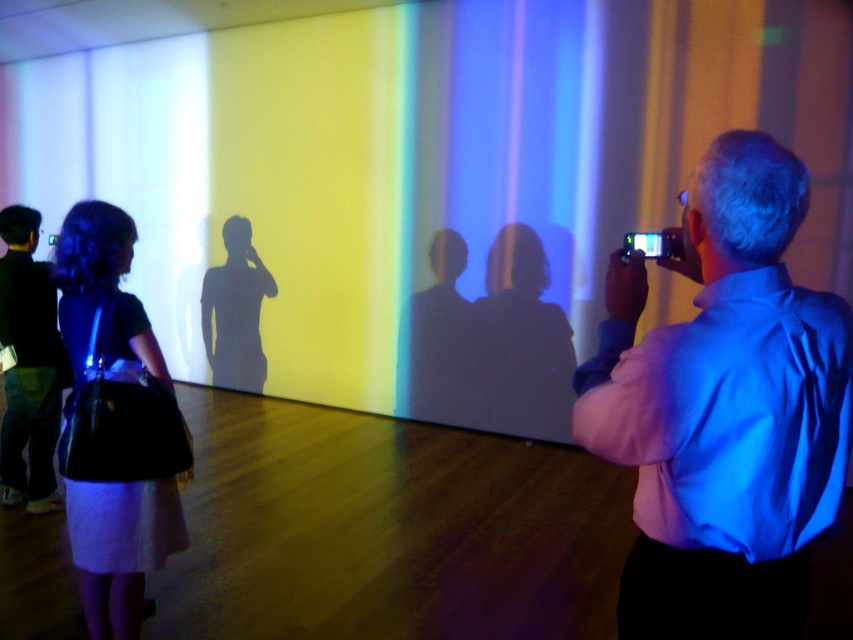
You are standing in the room where the art installation is displayed. You see a blue satin shirt at right and a matte black dress at left. Which clothing item is closer to you?

The blue satin shirt at right is closer to you because it is in front of the matte black dress at left.

You are standing in front of the art installation and want to place a small decorative item on the wall. You have two options for placement coordinates on the wall, point A at point (71, 269) and point B at point (49, 496). Which point is closer to you so that the item is more visible?

Point A at point (71, 269) is closer to the viewer than point B at point (49, 496), so placing the item there would make it more visible.